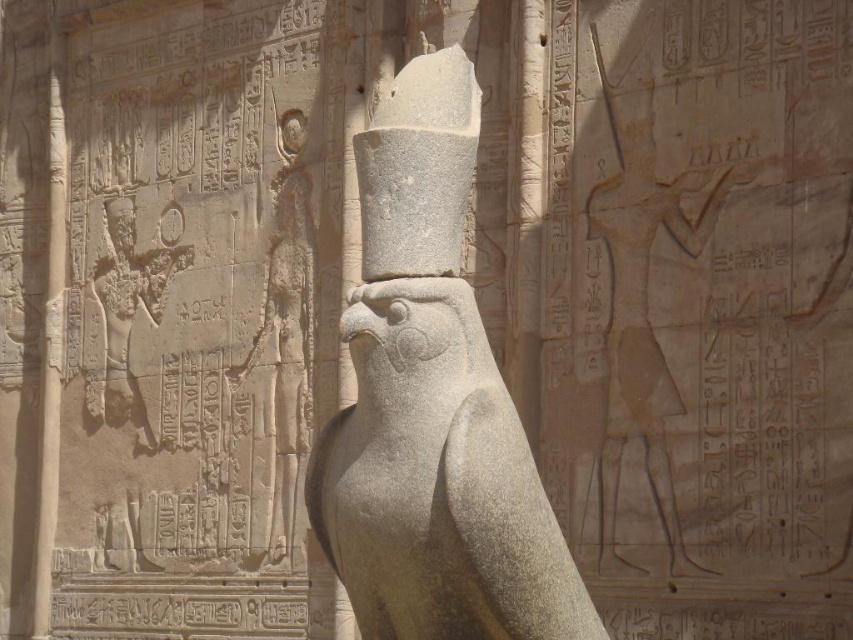
Question: Which of these objects is positioned closest to the gray stone statue at center?

Choices:
 (A) gray stone bird at center
 (B) smooth stone statue at center
 (C) matte stone pharaoh at left

Answer: (C)

Question: Is gray stone bird at center to the right of matte stone pharaoh at left from the viewer's perspective?

Choices:
 (A) yes
 (B) no

Answer: (A)

Question: Which point appears closest to the camera in this image?

Choices:
 (A) (125, 195)
 (B) (682, 572)
 (C) (303, 182)

Answer: (B)

Question: Is smooth stone statue at center positioned at the back of matte stone pharaoh at left?

Choices:
 (A) no
 (B) yes

Answer: (A)

Question: Considering the real-world distances, which object is closest to the gray stone bird at center?

Choices:
 (A) matte stone pharaoh at left
 (B) smooth stone statue at center
 (C) gray stone statue at center

Answer: (B)

Question: Can you confirm if smooth stone statue at center is positioned above gray stone statue at center?

Choices:
 (A) no
 (B) yes

Answer: (B)